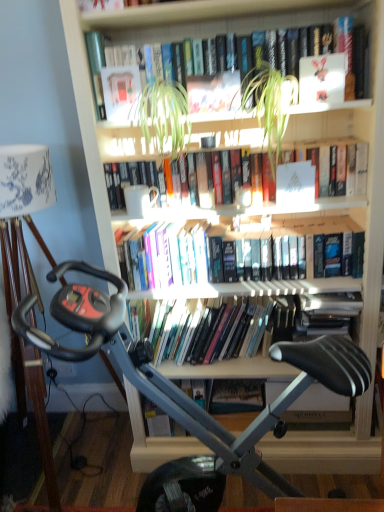
Where is `free location above hardcover books at center, acting as the 2th book starting from the top (from a real-world perspective)`? The image size is (384, 512). free location above hardcover books at center, acting as the 2th book starting from the top (from a real-world perspective) is located at coordinates (192, 146).